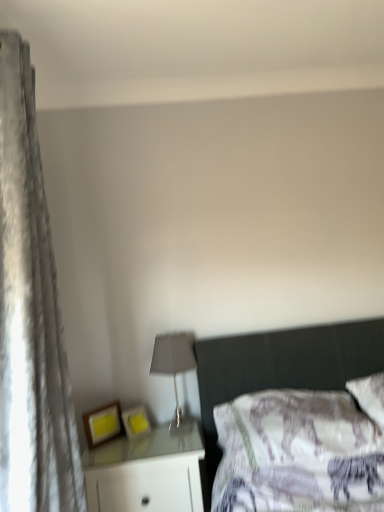
Where is `vacant space in between matte wooden picture frame at lower left, which ranks as the 2th picture frame in right-to-left order, and matte yellow picture frame at lower center, the 1th picture frame when ordered from right to left`? This screenshot has width=384, height=512. vacant space in between matte wooden picture frame at lower left, which ranks as the 2th picture frame in right-to-left order, and matte yellow picture frame at lower center, the 1th picture frame when ordered from right to left is located at coordinates (118, 441).